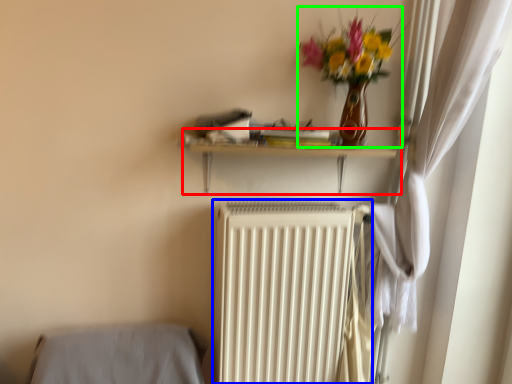
Question: Considering the real-world distances, which object is closest to shelf (highlighted by a red box)? radiator (highlighted by a blue box) or floral arrangement (highlighted by a green box).

Choices:
 (A) radiator
 (B) floral arrangement

Answer: (B)